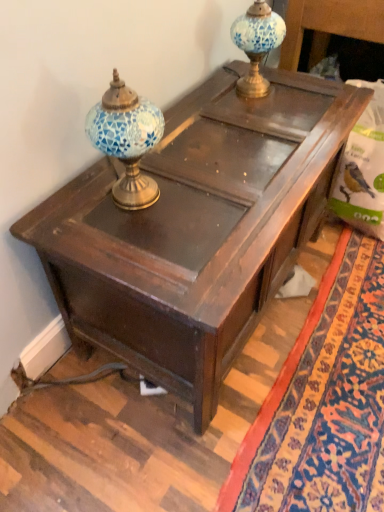
Identify the location of vacant space that is to the left of blue mosaic glass lamp at upper center, acting as the 1th candle holder starting from the back. The image size is (384, 512). (213, 93).